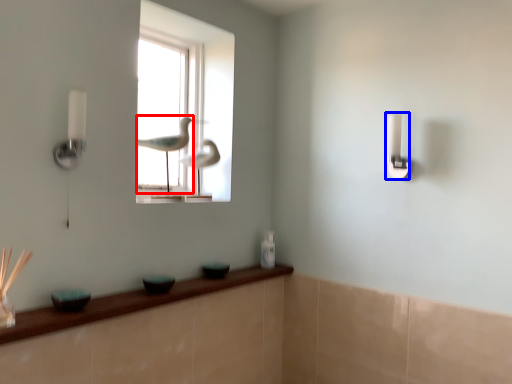
Question: Which of the following is the farthest to the observer, bird (highlighted by a red box) or light switch (highlighted by a blue box)?

Choices:
 (A) bird
 (B) light switch

Answer: (A)